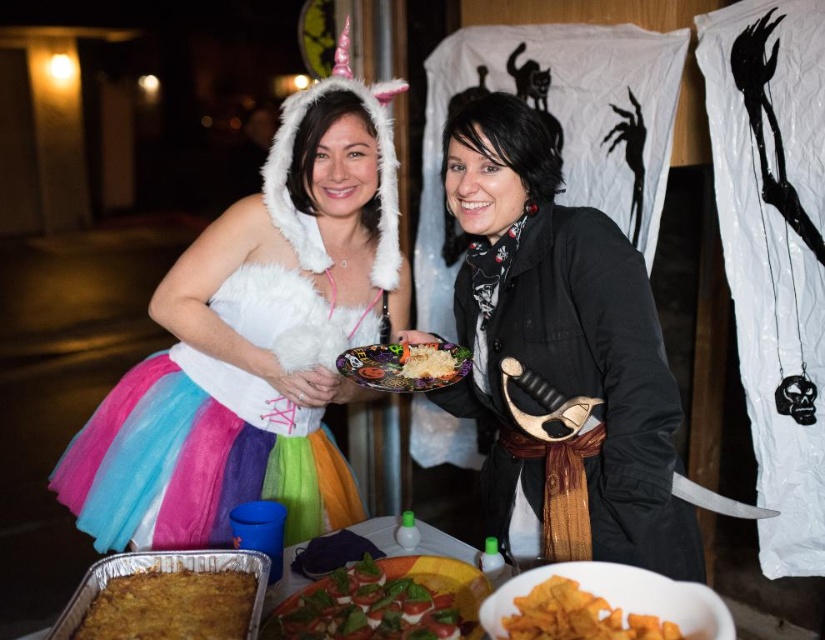
You are standing in the Halloween event and want to take a photo of both the unicorn costume and the pirate costume. The unicorn costume is located at point (300,385) and the pirate costume is at point (574,624). Which costume is closer to you?

The unicorn costume at point (300,385) is closer to you because point (300,385) is further to the viewer than point (574,624).

You are a photographer at the Halloween event and need to capture a clear photo of the golden crispy chips at lower center without the white fluffy unicorn costume at center blocking them. Based on their positions, is this possible?

The white fluffy unicorn costume at center is positioned over golden crispy chips at lower center, so taking a clear photo of the golden crispy chips at lower center without the unicorn costume blocking them would not be possible from the current angle.